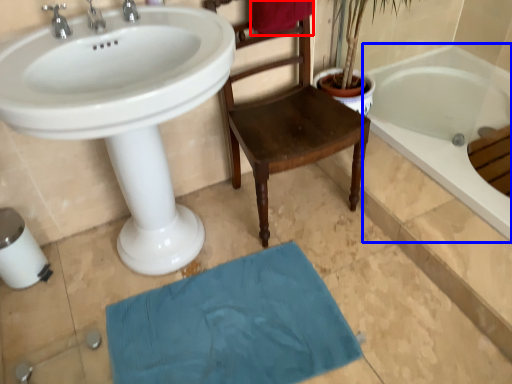
Question: Among these objects, which one is nearest to the camera, beach towel (highlighted by a red box) or bathtub (highlighted by a blue box)?

Choices:
 (A) beach towel
 (B) bathtub

Answer: (A)